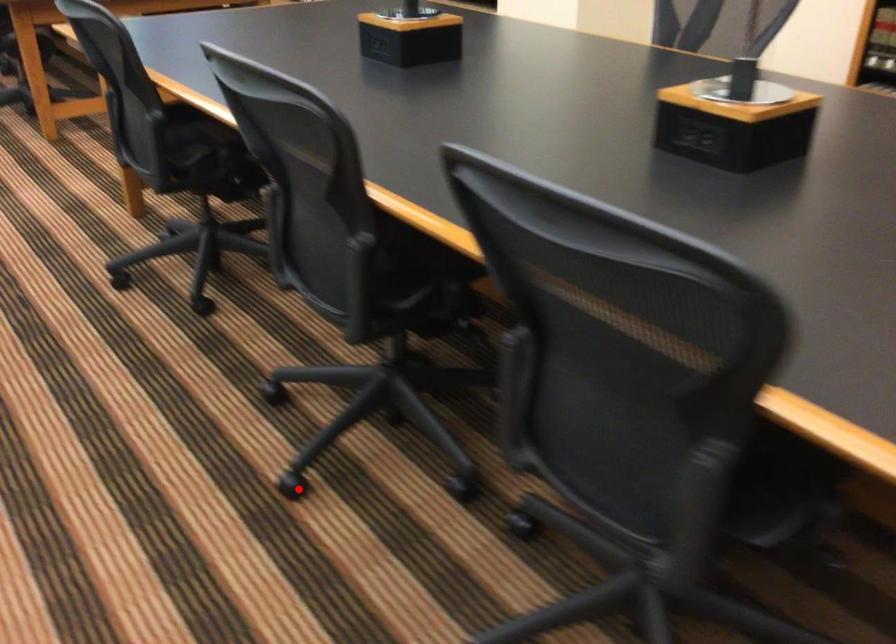
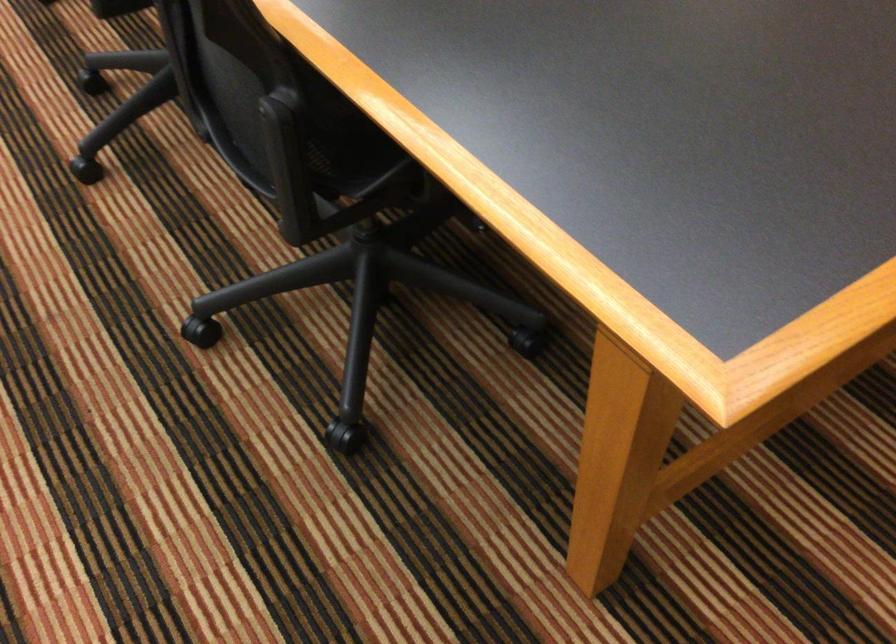
Find the pixel in the second image that matches the highlighted location in the first image.

(85, 169)